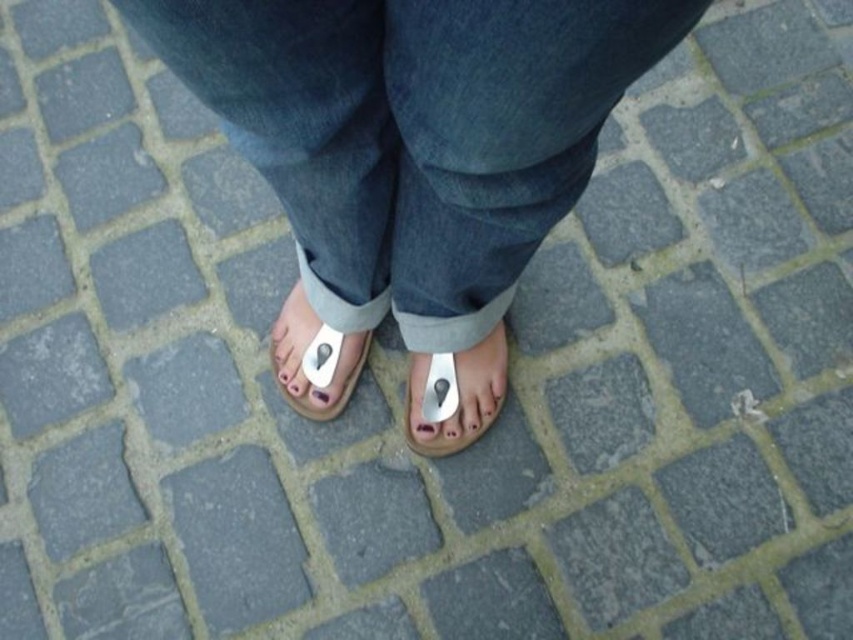
Question: Does denim at center have a smaller size compared to silver metallic flip-flop at center?

Choices:
 (A) no
 (B) yes

Answer: (A)

Question: Does silver metallic flip-flop at center have a lesser width compared to metallic silver flip-flop at center?

Choices:
 (A) yes
 (B) no

Answer: (A)

Question: Can you confirm if denim at center is positioned to the left of silver metallic flip-flop at center?

Choices:
 (A) yes
 (B) no

Answer: (A)

Question: Which point appears farthest from the camera in this image?

Choices:
 (A) (270, 61)
 (B) (430, 440)
 (C) (335, 368)
 (D) (448, 376)

Answer: (B)

Question: Which point appears closest to the camera in this image?

Choices:
 (A) (457, 433)
 (B) (428, 436)
 (C) (312, 234)

Answer: (C)

Question: Which point is farther from the camera taking this photo?

Choices:
 (A) (543, 96)
 (B) (439, 428)

Answer: (B)